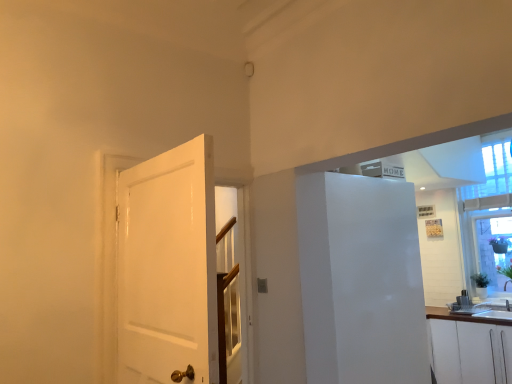
Question: Is white glossy refrigerator at right facing away from transparent glass window at upper right?

Choices:
 (A) no
 (B) yes

Answer: (A)

Question: From the image's perspective, does white glossy refrigerator at right appear lower than transparent glass window at upper right?

Choices:
 (A) no
 (B) yes

Answer: (B)

Question: Is there a large distance between white glossy refrigerator at right and transparent glass window at upper right?

Choices:
 (A) no
 (B) yes

Answer: (B)

Question: From a real-world perspective, is white glossy refrigerator at right positioned over transparent glass window at upper right based on gravity?

Choices:
 (A) yes
 (B) no

Answer: (B)

Question: From a real-world perspective, is white glossy refrigerator at right positioned under transparent glass window at upper right based on gravity?

Choices:
 (A) no
 (B) yes

Answer: (B)

Question: Would you say white matte cabinet at lower right is to the left or to the right of white glossy door at left in the picture?

Choices:
 (A) right
 (B) left

Answer: (A)

Question: In terms of size, does white matte cabinet at lower right appear bigger or smaller than white glossy door at left?

Choices:
 (A) small
 (B) big

Answer: (B)

Question: Looking at their shapes, would you say white matte cabinet at lower right is wider or thinner than white glossy door at left?

Choices:
 (A) thin
 (B) wide

Answer: (B)

Question: Considering the positions of white matte cabinet at lower right and white glossy door at left in the image, is white matte cabinet at lower right taller or shorter than white glossy door at left?

Choices:
 (A) tall
 (B) short

Answer: (B)

Question: Considering their positions, is white glossy refrigerator at right located in front of or behind white glossy door at left?

Choices:
 (A) behind
 (B) front

Answer: (A)

Question: Based on their sizes in the image, would you say white glossy refrigerator at right is bigger or smaller than white glossy door at left?

Choices:
 (A) big
 (B) small

Answer: (A)

Question: From the image's perspective, is white glossy refrigerator at right located above or below white glossy door at left?

Choices:
 (A) below
 (B) above

Answer: (A)

Question: Would you say white glossy refrigerator at right is to the left or to the right of white glossy door at left in the picture?

Choices:
 (A) right
 (B) left

Answer: (A)

Question: Would you say white glossy door at left is to the left or to the right of white matte cabinet at lower right in the picture?

Choices:
 (A) left
 (B) right

Answer: (A)

Question: Does point (186, 178) appear closer or farther from the camera than point (463, 336)?

Choices:
 (A) farther
 (B) closer

Answer: (B)